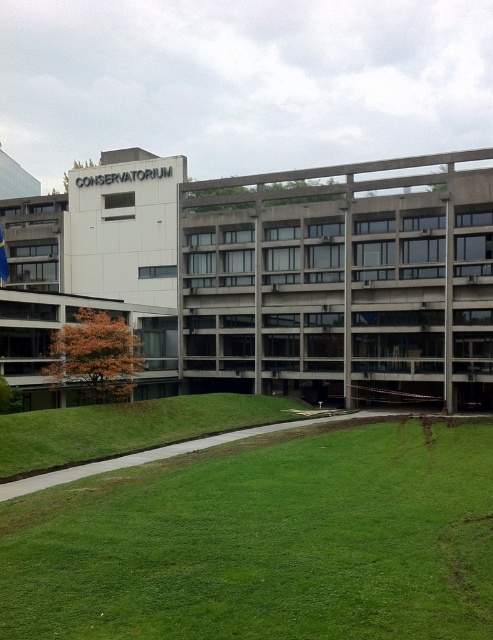
Question: Is green grass at lower center below concrete building at center?

Choices:
 (A) yes
 (B) no

Answer: (A)

Question: Observing the image, what is the correct spatial positioning of green grass at lower center in reference to concrete building at center?

Choices:
 (A) above
 (B) below

Answer: (B)

Question: Does green grass at lower center have a lesser width compared to concrete building at center?

Choices:
 (A) no
 (B) yes

Answer: (B)

Question: Among these points, which one is farthest from the camera?

Choices:
 (A) (327, 436)
 (B) (384, 387)

Answer: (B)

Question: Among these points, which one is farthest from the camera?

Choices:
 (A) (367, 179)
 (B) (460, 513)

Answer: (A)